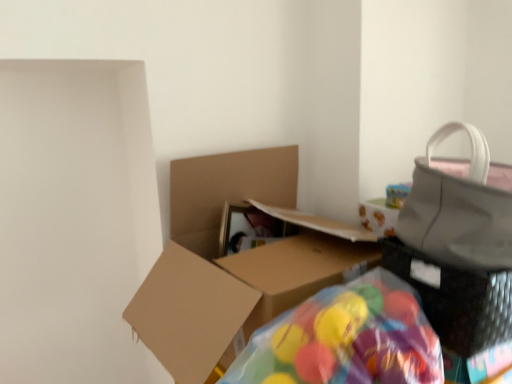
Question: Is the depth of matte gray handbag at right greater than that of brown cardboard box at center?

Choices:
 (A) yes
 (B) no

Answer: (B)

Question: Is matte gray handbag at right not close to brown cardboard box at center?

Choices:
 (A) yes
 (B) no

Answer: (B)

Question: Does matte gray handbag at right lie in front of brown cardboard box at center?

Choices:
 (A) yes
 (B) no

Answer: (A)

Question: Is matte gray handbag at right not within brown cardboard box at center?

Choices:
 (A) yes
 (B) no

Answer: (A)

Question: Are matte gray handbag at right and brown cardboard box at center beside each other?

Choices:
 (A) yes
 (B) no

Answer: (B)

Question: Is point (285, 178) positioned closer to the camera than point (311, 349)?

Choices:
 (A) closer
 (B) farther

Answer: (B)

Question: Is brown cardboard box at center in front of or behind translucent plastic bean bag chair at lower center in the image?

Choices:
 (A) front
 (B) behind

Answer: (B)

Question: In terms of width, does brown cardboard box at center look wider or thinner when compared to translucent plastic bean bag chair at lower center?

Choices:
 (A) wide
 (B) thin

Answer: (A)

Question: Is brown cardboard box at center bigger or smaller than translucent plastic bean bag chair at lower center?

Choices:
 (A) small
 (B) big

Answer: (B)

Question: Is matte gray handbag at right inside the boundaries of brown cardboard box at center, or outside?

Choices:
 (A) inside
 (B) outside

Answer: (B)

Question: From a real-world perspective, is matte gray handbag at right physically located above or below brown cardboard box at center?

Choices:
 (A) above
 (B) below

Answer: (A)

Question: Considering their positions, is matte gray handbag at right located in front of or behind brown cardboard box at center?

Choices:
 (A) front
 (B) behind

Answer: (A)

Question: Considering the positions of matte gray handbag at right and brown cardboard box at center in the image, is matte gray handbag at right wider or thinner than brown cardboard box at center?

Choices:
 (A) wide
 (B) thin

Answer: (B)

Question: Based on their positions, is matte gray handbag at right located to the left or right of translucent plastic bean bag chair at lower center?

Choices:
 (A) right
 (B) left

Answer: (A)

Question: Is point (457, 221) positioned closer to the camera than point (359, 281)?

Choices:
 (A) closer
 (B) farther

Answer: (A)